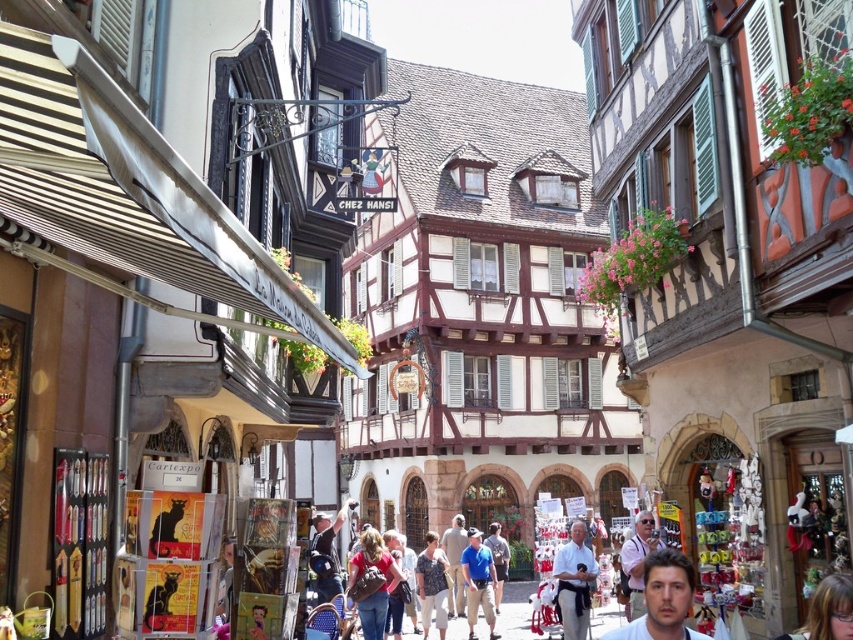
Can you confirm if light blue shirt at center is positioned to the left of light brown fabric shirt at center?

In fact, light blue shirt at center is to the right of light brown fabric shirt at center.

Which of these two, light blue shirt at center or light brown fabric shirt at center, stands shorter?

Standing shorter between the two is light blue shirt at center.

The image size is (853, 640). What are the coordinates of `light blue shirt at center` in the screenshot? It's located at (573, 582).

Is point (685, 602) closer to camera compared to point (573, 524)?

Yes, it is.

Locate an element on the screen. smooth skin face at center is located at coordinates (663, 600).

Measure the distance between light blue shirt at center and camera.

light blue shirt at center is 51.27 meters from camera.

How much distance is there between light blue shirt at center and blue denim shorts at center?

The distance of light blue shirt at center from blue denim shorts at center is 18.74 meters.

Is point (578, 522) farther from viewer compared to point (451, 602)?

No, (578, 522) is in front of (451, 602).

At what (x,y) coordinates should I click in order to perform the action: click on light blue shirt at center. Please return your answer as a coordinate pair (x, y). Looking at the image, I should click on (573, 582).